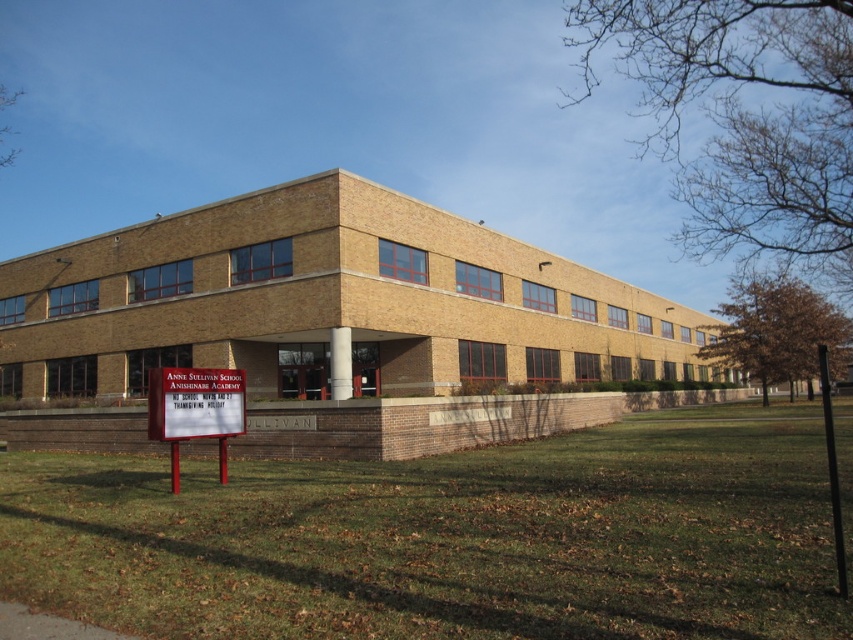
Does brown brick building at center appear under red plastic sign at lower left?

No.

Between brown brick building at center and red plastic sign at lower left, which one has more height?

brown brick building at center

Where is `brown brick building at center`? This screenshot has width=853, height=640. brown brick building at center is located at coordinates (344, 323).

Identify the location of brown brick building at center. This screenshot has width=853, height=640. (344, 323).

Is brown brick building at center closer to the viewer compared to white plastic sign at lower left?

No, it is not.

Find the location of a particular element. brown brick building at center is located at coordinates (344, 323).

Where is `brown brick building at center`? Image resolution: width=853 pixels, height=640 pixels. brown brick building at center is located at coordinates (344, 323).

At what (x,y) coordinates should I click in order to perform the action: click on white plastic sign at lower left. Please return your answer as a coordinate pair (x, y). Looking at the image, I should click on (195, 410).

Which of these two, white plastic sign at lower left or red plastic sign at lower left, stands taller?

red plastic sign at lower left

Who is more distant from viewer, (213, 417) or (193, 410)?

The point (213, 417) is more distant.

Identify the location of white plastic sign at lower left. The width and height of the screenshot is (853, 640). (195, 410).